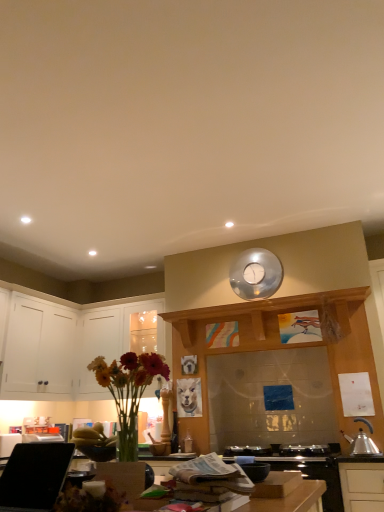
Question: Is white glossy cabinets at left, which ranks as the second cabinetry in left-to-right order, wider than wooden surface at center?

Choices:
 (A) yes
 (B) no

Answer: (A)

Question: From a real-world perspective, is white glossy cabinets at left, which ranks as the second cabinetry in left-to-right order, beneath wooden surface at center?

Choices:
 (A) yes
 (B) no

Answer: (B)

Question: Is white glossy cabinets at left, the first cabinetry in the right-to-left sequence, shorter than wooden surface at center?

Choices:
 (A) no
 (B) yes

Answer: (A)

Question: Considering the relative sizes of white glossy cabinets at left, the first cabinetry in the right-to-left sequence, and wooden surface at center in the image provided, is white glossy cabinets at left, the first cabinetry in the right-to-left sequence, taller than wooden surface at center?

Choices:
 (A) no
 (B) yes

Answer: (B)

Question: From the image's perspective, would you say white glossy cabinets at left, which ranks as the second cabinetry in left-to-right order, is shown under wooden surface at center?

Choices:
 (A) no
 (B) yes

Answer: (B)

Question: In terms of size, does metallic silver kettle at lower right appear bigger or smaller than black glass stove at lower center?

Choices:
 (A) small
 (B) big

Answer: (A)

Question: From the image's perspective, is metallic silver kettle at lower right above or below black glass stove at lower center?

Choices:
 (A) above
 (B) below

Answer: (A)

Question: Is point (359, 443) positioned closer to the camera than point (284, 467)?

Choices:
 (A) farther
 (B) closer

Answer: (A)

Question: Relative to black glass stove at lower center, is metallic silver kettle at lower right in front or behind?

Choices:
 (A) front
 (B) behind

Answer: (B)

Question: Visually, is white glossy cabinets at left, which ranks as the second cabinetry in left-to-right order, positioned to the left or to the right of matte glass vase with flowers at lower left?

Choices:
 (A) right
 (B) left

Answer: (B)

Question: From their relative heights in the image, would you say white glossy cabinets at left, the first cabinetry in the right-to-left sequence, is taller or shorter than matte glass vase with flowers at lower left?

Choices:
 (A) tall
 (B) short

Answer: (A)

Question: In terms of size, does white glossy cabinets at left, which ranks as the second cabinetry in left-to-right order, appear bigger or smaller than matte glass vase with flowers at lower left?

Choices:
 (A) small
 (B) big

Answer: (B)

Question: Is white glossy cabinets at left, which ranks as the second cabinetry in left-to-right order, situated inside matte glass vase with flowers at lower left or outside?

Choices:
 (A) outside
 (B) inside

Answer: (A)

Question: Would you say matte glass vase with flowers at lower left is inside or outside white matte cabinet at left, the second cabinetry in the right-to-left sequence?

Choices:
 (A) outside
 (B) inside

Answer: (A)

Question: Considering the positions of matte glass vase with flowers at lower left and white matte cabinet at left, the second cabinetry in the right-to-left sequence, in the image, is matte glass vase with flowers at lower left bigger or smaller than white matte cabinet at left, the second cabinetry in the right-to-left sequence,?

Choices:
 (A) small
 (B) big

Answer: (A)